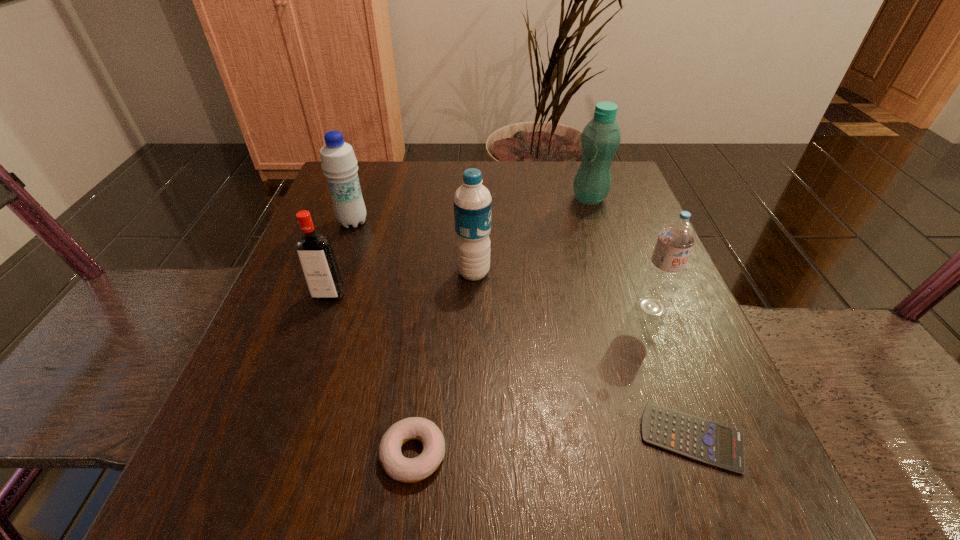
The height and width of the screenshot is (540, 960). In order to click on free space located at the front cap of the farthest water bottle in this screenshot , I will do `click(435, 198)`.

You are a GUI agent. You are given a task and a screenshot of the screen. Output one action in this format:
    pyautogui.click(x=<x>, y=<y>)
    Task: Click on the free space located 0.320m at the front cap of the farthest water bottle
    
    Given the screenshot: What is the action you would take?
    pyautogui.click(x=435, y=198)

Find the location of `blank space located 0.220m at the front cap of the farthest water bottle`. blank space located 0.220m at the front cap of the farthest water bottle is located at coordinates (478, 198).

Image resolution: width=960 pixels, height=540 pixels. Identify the location of vacant space located on the label of the third farthest water bottle. pyautogui.click(x=521, y=272).

I want to click on vacant area situated on the front of the leftmost water bottle, so click(x=320, y=315).

The width and height of the screenshot is (960, 540). Find the location of `vacant region located on the left of the nearest water bottle`. vacant region located on the left of the nearest water bottle is located at coordinates (512, 307).

In order to click on vacant space located on the front and back of the vodka in this screenshot , I will do `click(273, 456)`.

Where is `free point located 0.230m on the back of the second shortest object`? free point located 0.230m on the back of the second shortest object is located at coordinates (430, 305).

The image size is (960, 540). Identify the location of vacant space located 0.110m on the left of the shortest object. (561, 438).

I want to click on doughnut located at the near edge, so click(x=408, y=470).